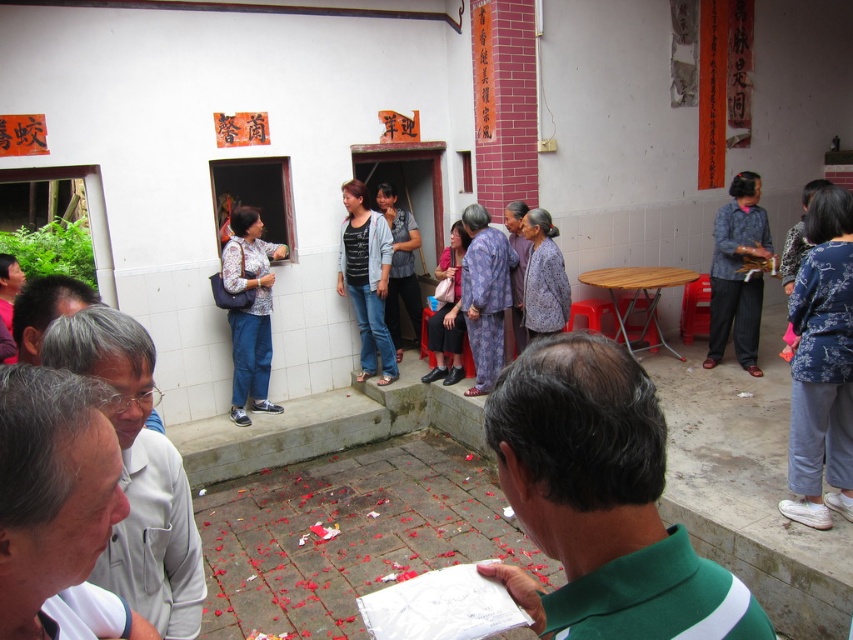
You are taking a photo of the scene and want to focus on the purple printed dress at center and the red plastic stool at center. Which object is closer to your camera lens?

The purple printed dress at center is closer to the viewer than the red plastic stool at center, so the dress will be in focus first.

In the scene shown: You are a photographer positioned at the entrance of the building. You want to capture a photo that includes both the blue textured blouse at right and the purple printed dress at center. Given that your camera has a maximum focus range of 2 meters, will you be able to include both subjects in the same frame without moving?

The distance between the blue textured blouse at right and the purple printed dress at center is 2.00 meters. Since your camera can focus up to 2 meters, you can include both subjects in the same frame without moving.

You are a photographer trying to capture a clear shot of the purple textured jacket at center without the denim jeans at center blocking it. What should you do?

The denim jeans at center is positioned over the purple textured jacket at center, so to avoid blocking the jacket, you should adjust your angle or move the denim jeans at center out of the way.